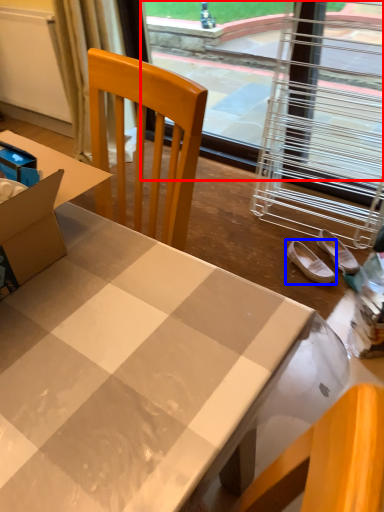
Question: Which of the following is the farthest to the observer, window screen (highlighted by a red box) or footwear (highlighted by a blue box)?

Choices:
 (A) window screen
 (B) footwear

Answer: (A)